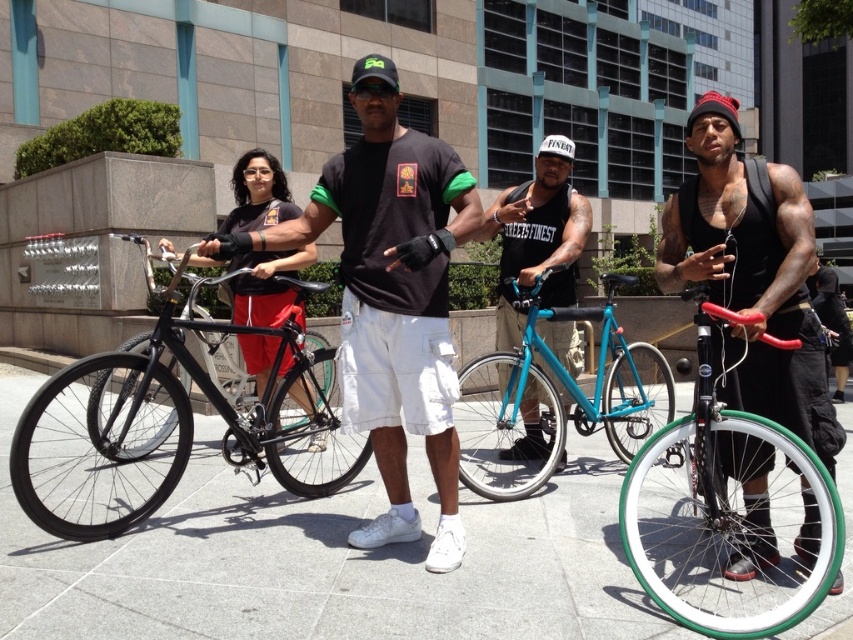
You are a photographer wanting to capture both the teal glossy bicycle at center and the matte black bicycle at left in a single frame. Based on their positions, which bicycle should you position closer to the left edge of your camera view to include both?

The matte black bicycle at left should be positioned closer to the left edge of your camera view since it is located to the left of the teal glossy bicycle at center.